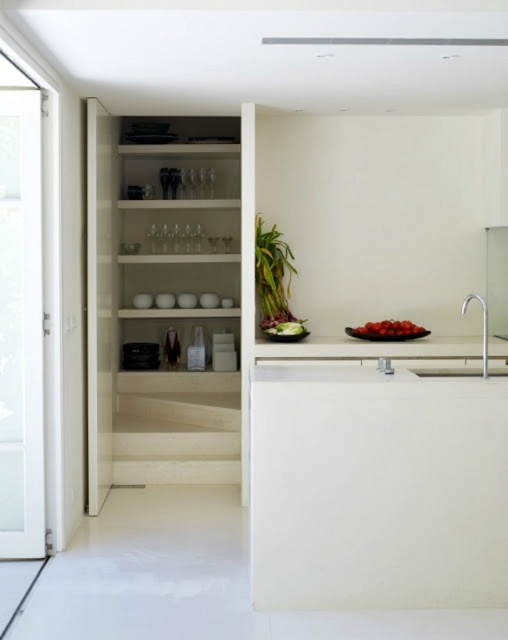
Question: Is clear glassware at center below satin nickel faucet at right?

Choices:
 (A) yes
 (B) no

Answer: (B)

Question: Which point is farther to the camera?

Choices:
 (A) (186, 243)
 (B) (315, 356)
 (C) (415, 333)

Answer: (A)

Question: Is white glossy countertop at center smaller than satin nickel faucet at right?

Choices:
 (A) no
 (B) yes

Answer: (B)

Question: Estimate the real-world distances between objects in this image. Which object is closer to the clear glassware at center?

Choices:
 (A) white matte shelves at center
 (B) white glossy bowls at center

Answer: (B)

Question: In this image, where is clear glassware at center located relative to shiny red tomatoes at center?

Choices:
 (A) above
 (B) below

Answer: (A)

Question: Estimate the real-world distances between objects in this image. Which object is closer to the satin nickel faucet at right?

Choices:
 (A) clear glassware at center
 (B) white glossy countertop at center
 (C) white glass door at left

Answer: (B)